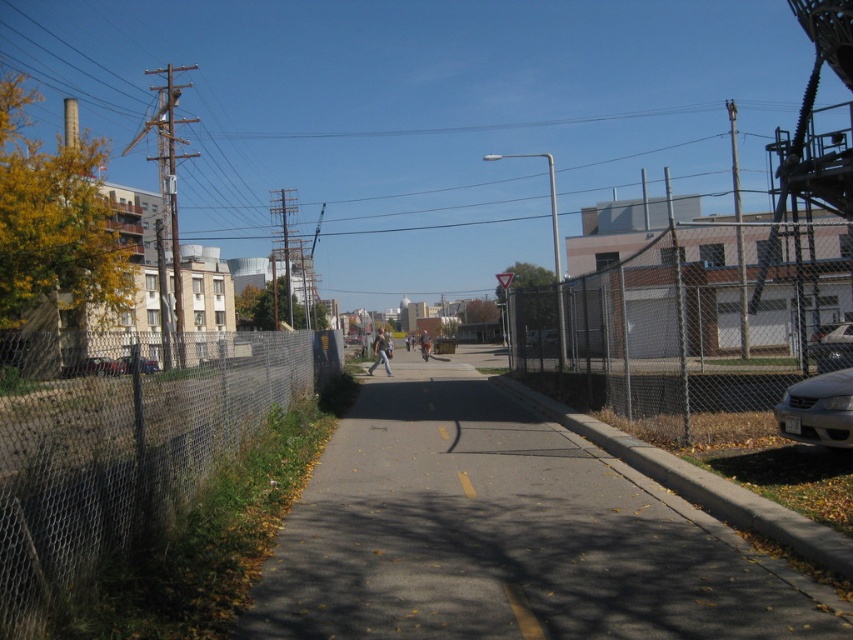
You are standing at the starting point of the pathway and want to reach the point marked at coordinates point [804,625]. Given that the pathway is 4.40 meters long, can you walk straight ahead to reach it without deviating?

Yes, you can walk straight ahead because the point [804,625] is 4.40 meters away from you, matching the pathway length.

You are standing on the gray asphalt pavement at center and looking down at your light blue jeans at center. Which object is closer to your eyes?

The light blue jeans at center are closer to your eyes since they are shorter than the gray asphalt pavement at center.